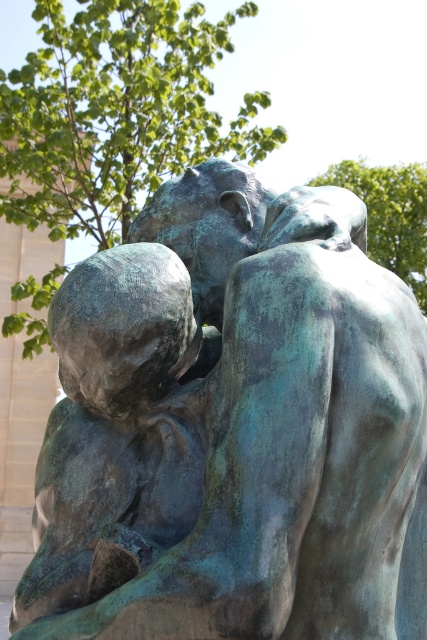
Question: Can you confirm if green patina bronze statue at center is positioned to the left of green verdigris statue at upper center?

Choices:
 (A) no
 (B) yes

Answer: (B)

Question: Is green leafy tree at upper center wider than green verdigris statue at upper center?

Choices:
 (A) no
 (B) yes

Answer: (B)

Question: Considering the relative positions of green patina bronze statue at center and green leafy tree at upper center in the image provided, where is green patina bronze statue at center located with respect to green leafy tree at upper center?

Choices:
 (A) above
 (B) below

Answer: (B)

Question: Which object is positioned closest to the green leafy tree at upper center?

Choices:
 (A) green verdigris statue at upper center
 (B) green patina bronze statue at center

Answer: (A)

Question: Estimate the real-world distances between objects in this image. Which object is farther from the green leafy tree at upper center?

Choices:
 (A) green verdigris statue at upper center
 (B) green patina bronze statue at center

Answer: (B)

Question: Which point is closer to the camera taking this photo?

Choices:
 (A) (368, 188)
 (B) (315, 307)
 (C) (8, 205)

Answer: (B)